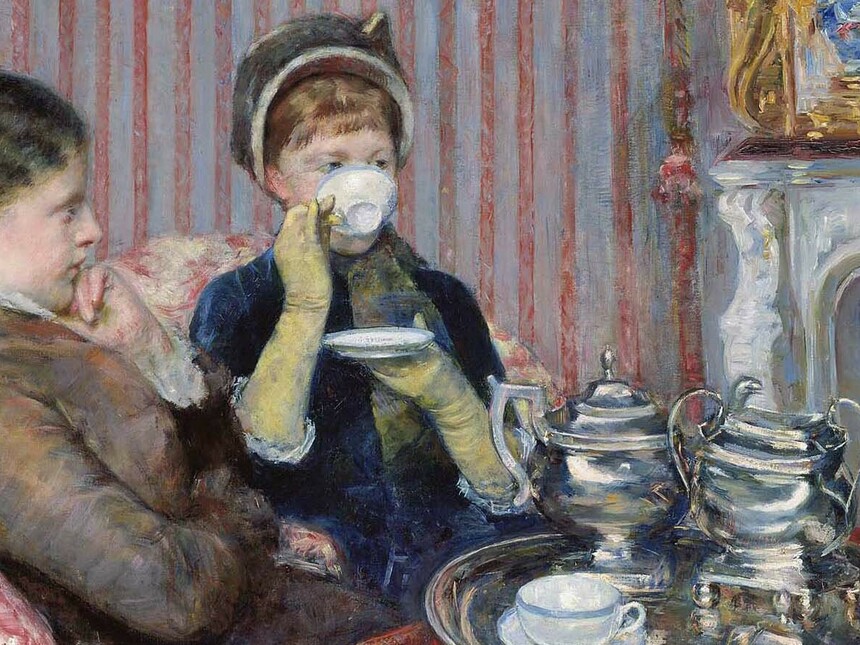
This screenshot has height=645, width=860. In order to click on saucer in this screenshot , I will do `click(376, 340)`, `click(510, 629)`.